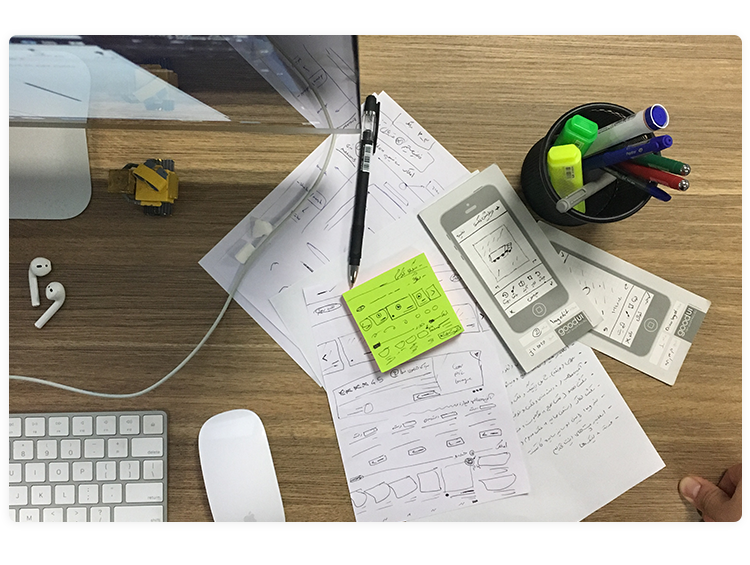
In order to click on sticky note in this screenshot , I will do `click(424, 314)`.